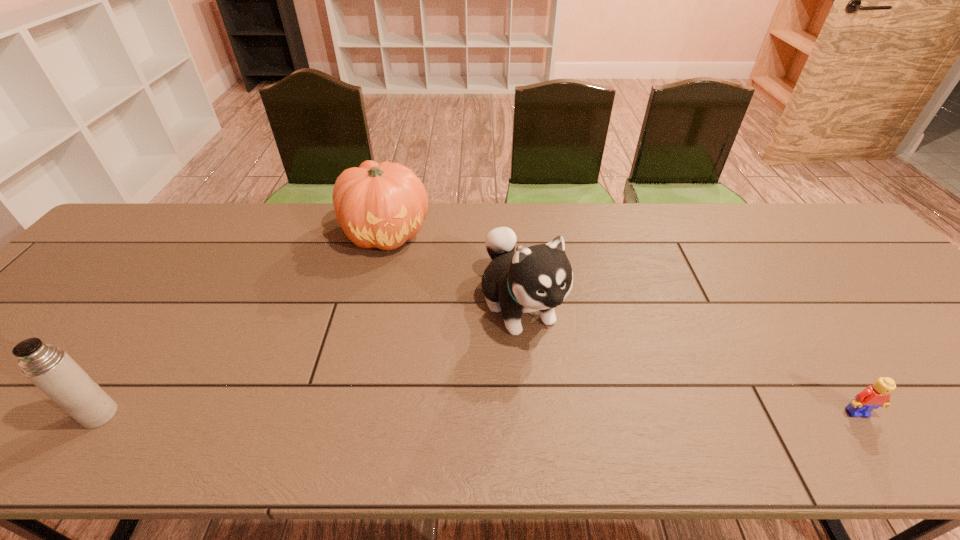
This screenshot has width=960, height=540. What are the coordinates of `thermos bottle` in the screenshot? It's located at (51, 369).

Where is `Lego`? Lego is located at coordinates (872, 397).

The width and height of the screenshot is (960, 540). Find the location of `the shortest object`. the shortest object is located at coordinates (872, 397).

Where is `pumpkin`? The width and height of the screenshot is (960, 540). pumpkin is located at coordinates (383, 205).

I want to click on the third object from right to left, so click(383, 205).

Where is `the third nearest object`? the third nearest object is located at coordinates (540, 277).

Where is `the second object from right to left`? The image size is (960, 540). the second object from right to left is located at coordinates (540, 277).

The image size is (960, 540). I want to click on free location located on the back of the leftmost object, so click(x=142, y=354).

This screenshot has width=960, height=540. I want to click on vacant space located on the carved face of the third object from right to left, so click(455, 364).

Find the location of `blank space located on the carved face of the third object from right to left`. blank space located on the carved face of the third object from right to left is located at coordinates (442, 340).